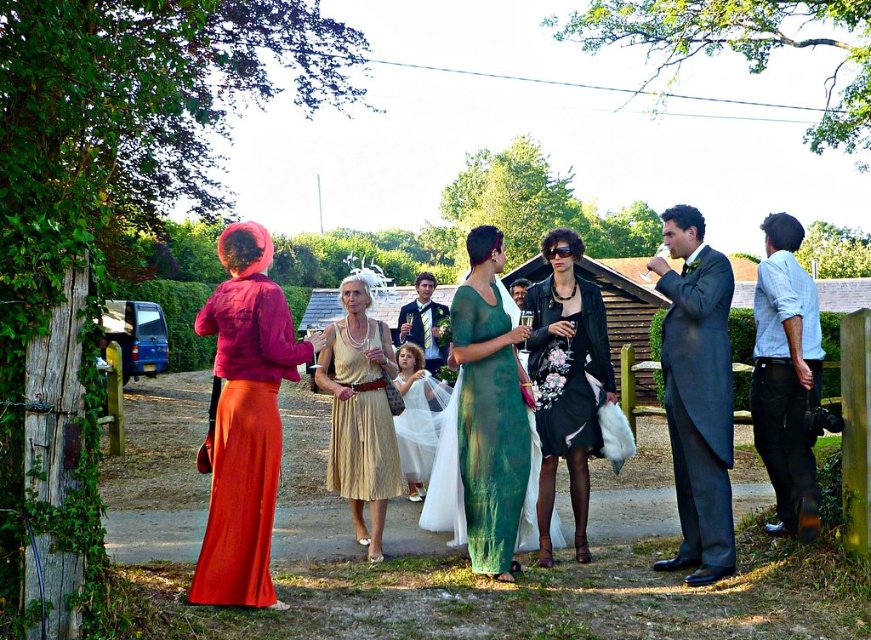
You are standing at the origin of the coordinate system in the image. You want to walk to the point at (372, 531) but there is an obstacle at point (672, 408). Will you encounter the obstacle before reaching your destination?

Yes, because point (672, 408) is in front of point (372, 531), so you will encounter the obstacle at point (672, 408) before reaching your destination at point (372, 531).

Based on the photo, you are at the center of the scene and want to hand a gift to the person wearing the matte pink jacket at center. In which direction should you move to reach them?

The matte pink jacket at center is located at point (245, 419), so you should move to the right and slightly upward to reach them.